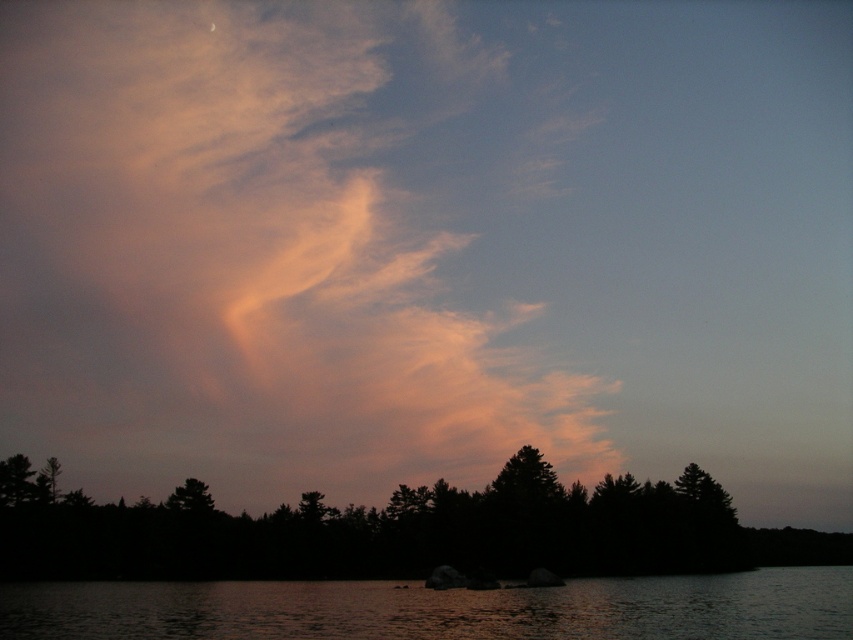
Question: Can you confirm if translucent pink cloud at upper center is bigger than dark water at lower center?

Choices:
 (A) yes
 (B) no

Answer: (A)

Question: Does translucent pink cloud at upper center have a smaller size compared to dark water at lower center?

Choices:
 (A) yes
 (B) no

Answer: (B)

Question: Which point is farther from the camera taking this photo?

Choices:
 (A) (252, 582)
 (B) (374, 342)

Answer: (B)

Question: Which point appears farthest from the camera in this image?

Choices:
 (A) (491, 632)
 (B) (544, 289)

Answer: (B)

Question: Is translucent pink cloud at upper center bigger than dark water at lower center?

Choices:
 (A) yes
 (B) no

Answer: (A)